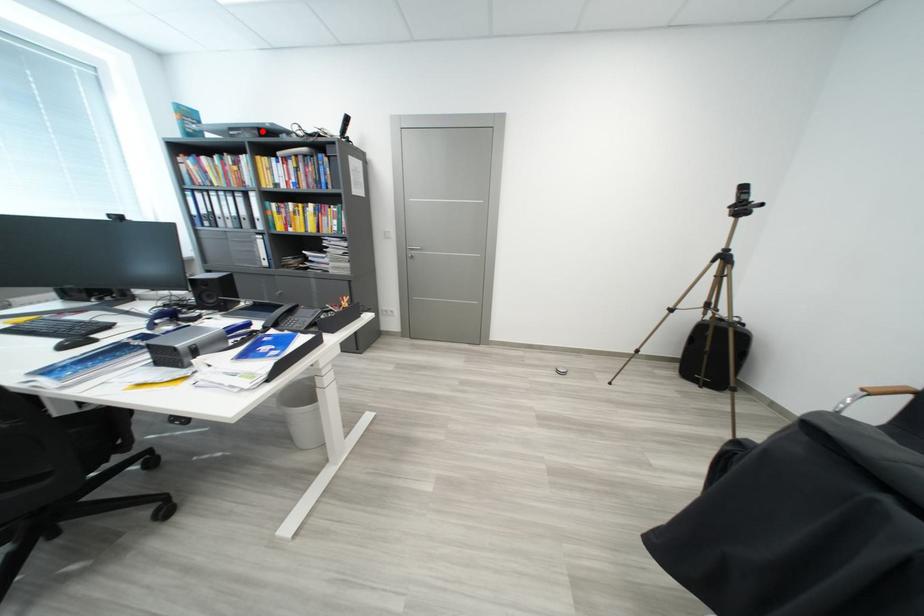
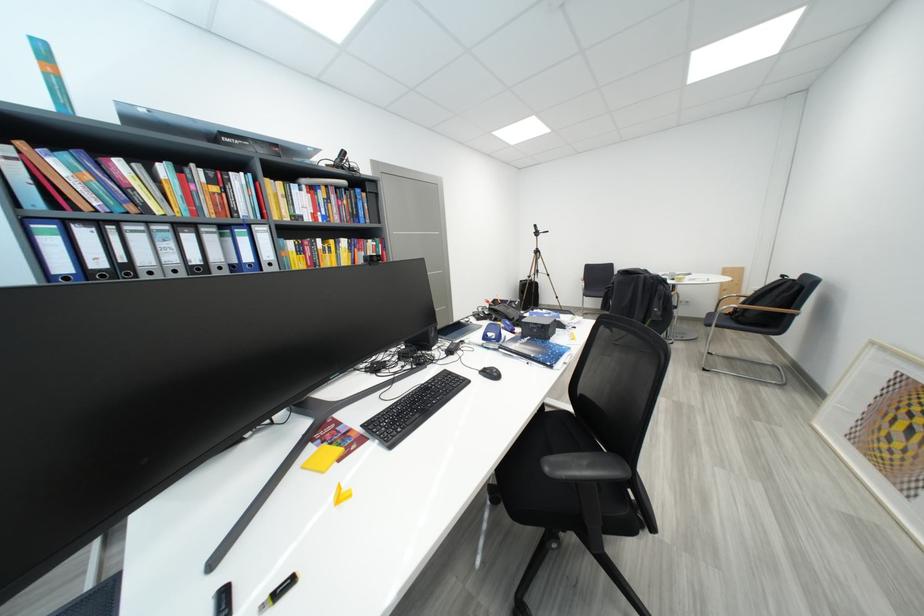
Locate, in the second image, the point that corresponds to the highlighted location in the first image.

(286, 148)